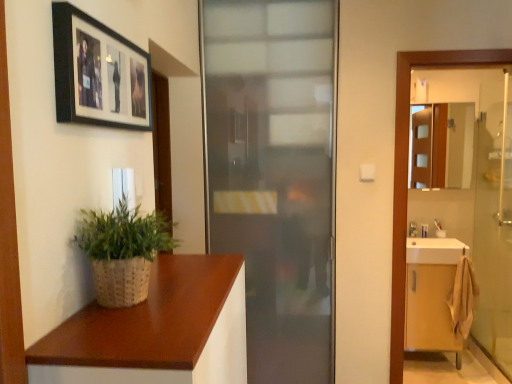
I want to click on free space above brown wood countertop at lower left (from a real-world perspective), so click(170, 296).